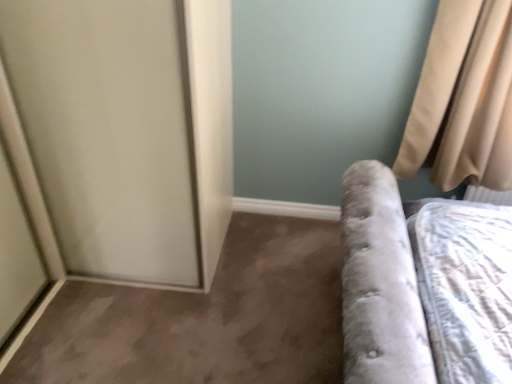
Question: Is beige fabric curtain at upper right turned away from white frosted glass screen door at left?

Choices:
 (A) no
 (B) yes

Answer: (A)

Question: Considering the relative positions of beige fabric curtain at upper right and white frosted glass screen door at left in the image provided, is beige fabric curtain at upper right behind white frosted glass screen door at left?

Choices:
 (A) yes
 (B) no

Answer: (A)

Question: Considering the relative positions of beige fabric curtain at upper right and white frosted glass screen door at left in the image provided, is beige fabric curtain at upper right to the left of white frosted glass screen door at left from the viewer's perspective?

Choices:
 (A) yes
 (B) no

Answer: (B)

Question: Is the surface of beige fabric curtain at upper right in direct contact with white frosted glass screen door at left?

Choices:
 (A) no
 (B) yes

Answer: (A)

Question: Is beige fabric curtain at upper right completely or partially outside of white frosted glass screen door at left?

Choices:
 (A) no
 (B) yes

Answer: (B)

Question: Is beige fabric curtain at upper right wider than white frosted glass screen door at left?

Choices:
 (A) no
 (B) yes

Answer: (A)

Question: From a real-world perspective, is white frosted glass screen door at left on top of beige fabric curtain at upper right?

Choices:
 (A) yes
 (B) no

Answer: (B)

Question: Does white frosted glass screen door at left lie behind beige fabric curtain at upper right?

Choices:
 (A) no
 (B) yes

Answer: (A)

Question: Is white frosted glass screen door at left touching beige fabric curtain at upper right?

Choices:
 (A) no
 (B) yes

Answer: (A)

Question: Is white frosted glass screen door at left located outside beige fabric curtain at upper right?

Choices:
 (A) yes
 (B) no

Answer: (A)

Question: Could you tell me if white frosted glass screen door at left is facing beige fabric curtain at upper right?

Choices:
 (A) no
 (B) yes

Answer: (A)

Question: Does white frosted glass screen door at left appear on the left side of beige fabric curtain at upper right?

Choices:
 (A) no
 (B) yes

Answer: (B)

Question: Considering their positions, is beige fabric curtain at upper right located in front of or behind white frosted glass screen door at left?

Choices:
 (A) behind
 (B) front

Answer: (A)